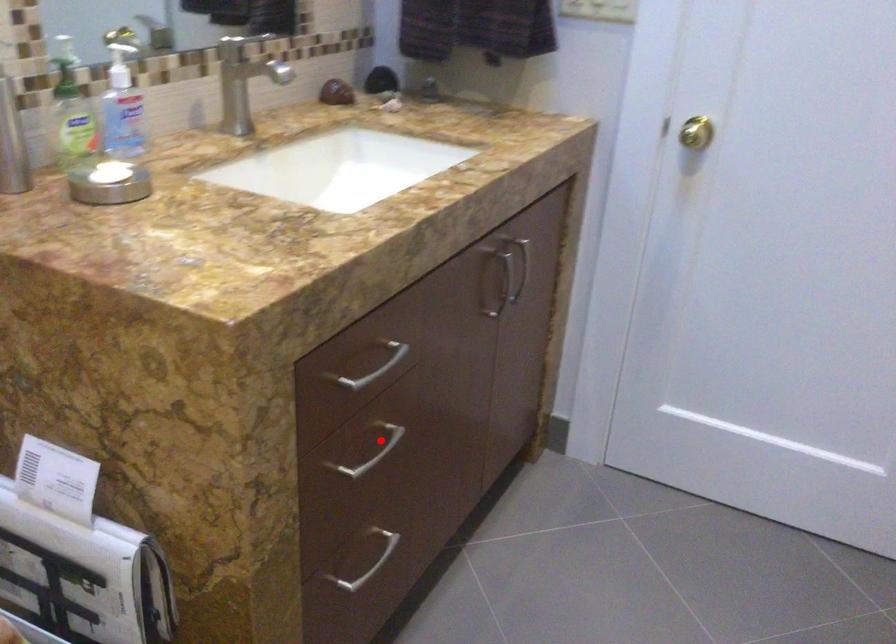
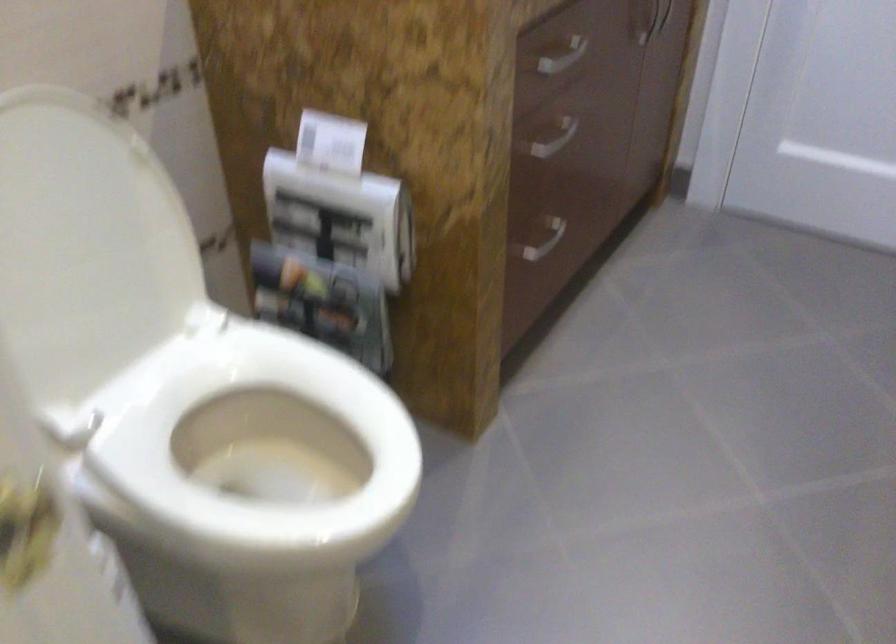
Locate, in the second image, the point that corresponds to the highlighted location in the first image.

(554, 138)